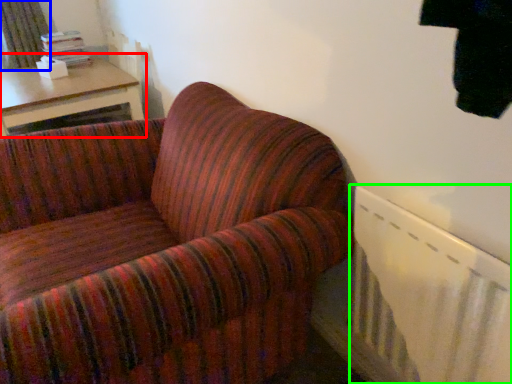
Question: Which is farther away from table (highlighted by a red box)? curtain (highlighted by a blue box) or radiator (highlighted by a green box)?

Choices:
 (A) curtain
 (B) radiator

Answer: (B)